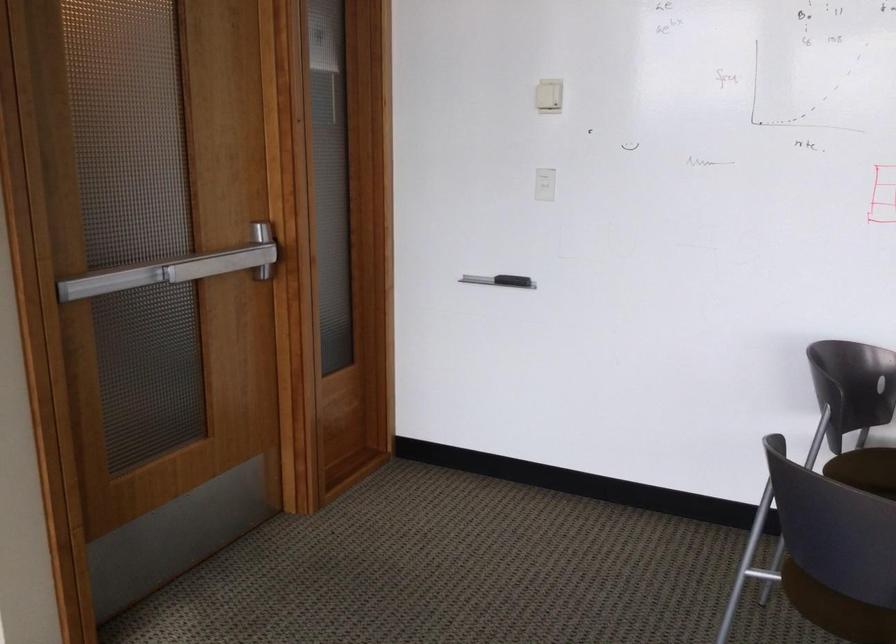
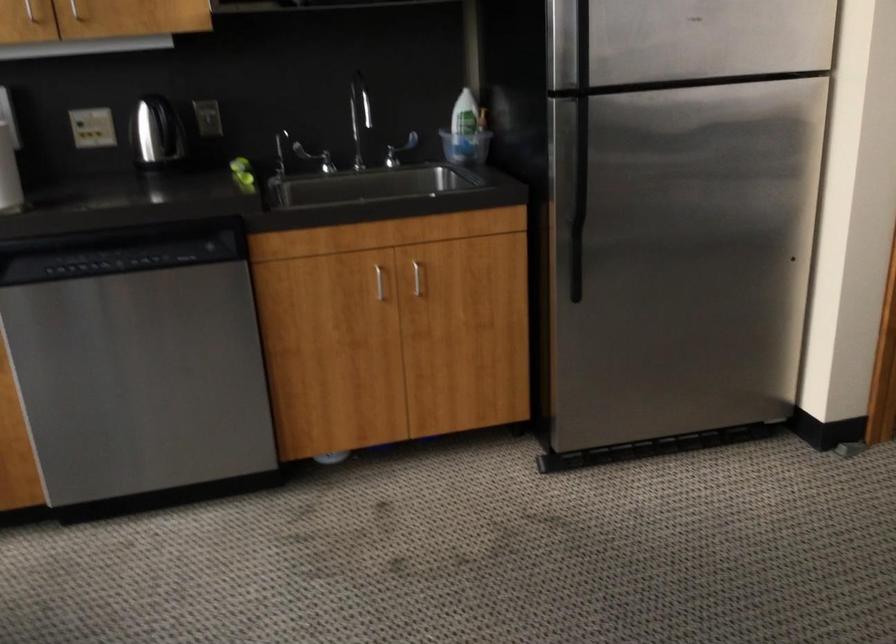
Question: Based on the continuous images, in which direction is the camera rotating? Reply with the corresponding letter.

Choices:
 (A) Left
 (B) Right
 (C) Up
 (D) Down

Answer: (A)